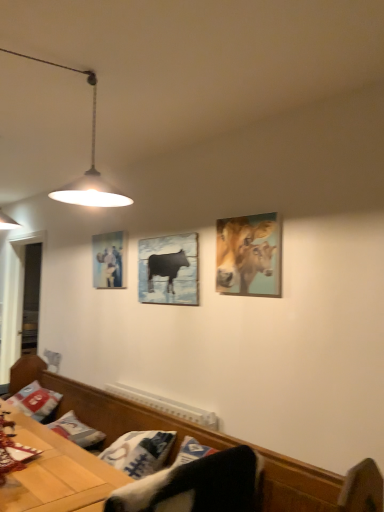
Question: Would you say white cotton pillow at lower left is outside golden textured cows at upper right?

Choices:
 (A) no
 (B) yes

Answer: (B)

Question: Considering the relative sizes of white cotton pillow at lower left and golden textured cows at upper right in the image provided, is white cotton pillow at lower left smaller than golden textured cows at upper right?

Choices:
 (A) yes
 (B) no

Answer: (B)

Question: Is white cotton pillow at lower left to the left of golden textured cows at upper right from the viewer's perspective?

Choices:
 (A) no
 (B) yes

Answer: (B)

Question: Are white cotton pillow at lower left and golden textured cows at upper right far apart?

Choices:
 (A) no
 (B) yes

Answer: (B)

Question: Is white cotton pillow at lower left shorter than golden textured cows at upper right?

Choices:
 (A) yes
 (B) no

Answer: (A)

Question: Is white cotton pillow at lower left wider than golden textured cows at upper right?

Choices:
 (A) yes
 (B) no

Answer: (A)

Question: Considering the relative positions of matte glass picture frame at upper left, marked as the first picture frame in a left-to-right arrangement, and matte black cow at center, which ranks as the 2th picture frame in back-to-front order, in the image provided, is matte glass picture frame at upper left, marked as the first picture frame in a left-to-right arrangement, in front of matte black cow at center, which ranks as the 2th picture frame in back-to-front order,?

Choices:
 (A) yes
 (B) no

Answer: (B)

Question: Is matte glass picture frame at upper left, placed as the second picture frame when sorted from front to back, positioned beyond the bounds of matte black cow at center, which ranks as the 1th picture frame in right-to-left order?

Choices:
 (A) yes
 (B) no

Answer: (A)

Question: Is matte glass picture frame at upper left, placed as the second picture frame when sorted from front to back, aimed at matte black cow at center, the first picture frame when ordered from front to back?

Choices:
 (A) yes
 (B) no

Answer: (B)

Question: Is the depth of matte glass picture frame at upper left, placed as the first picture frame when sorted from back to front, greater than that of matte black cow at center, the first picture frame when ordered from front to back?

Choices:
 (A) no
 (B) yes

Answer: (B)

Question: Is matte glass picture frame at upper left, the 2th picture frame in the right-to-left sequence, positioned with its back to matte black cow at center, which is the second picture frame from left to right?

Choices:
 (A) yes
 (B) no

Answer: (B)

Question: Can you confirm if matte glass picture frame at upper left, the 2th picture frame in the right-to-left sequence, is wider than matte black cow at center, which ranks as the 2th picture frame in back-to-front order?

Choices:
 (A) no
 (B) yes

Answer: (B)

Question: Is golden textured cows at upper right in front of wooden table at lower left?

Choices:
 (A) no
 (B) yes

Answer: (A)